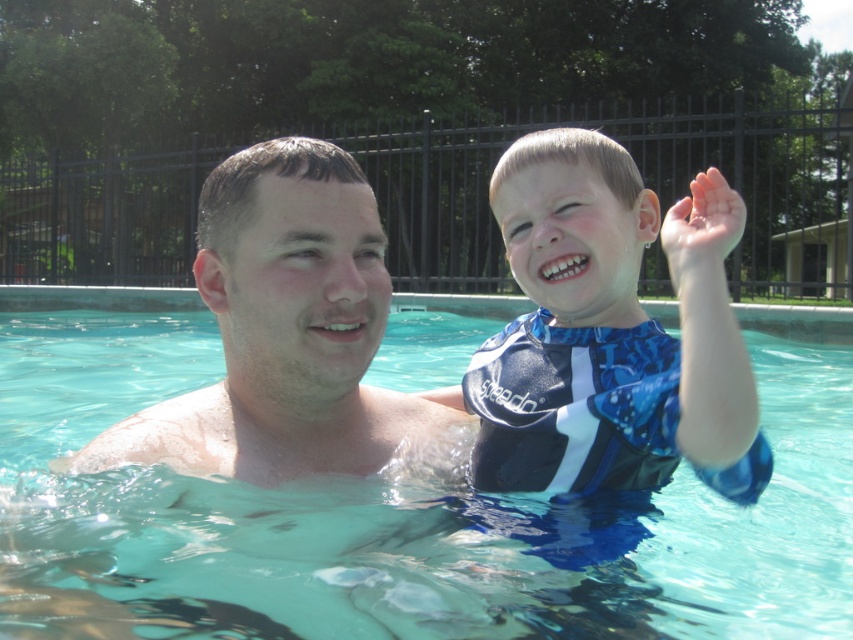
Question: Is clear blue water at upper center thinner than blue/white textured life vest at center?

Choices:
 (A) yes
 (B) no

Answer: (B)

Question: Which point is farther from the camera taking this photo?

Choices:
 (A) (161, 452)
 (B) (679, 266)

Answer: (A)

Question: Which of the following is the closest to the observer?

Choices:
 (A) (364, 188)
 (B) (689, 225)

Answer: (B)

Question: Is clear blue water at upper center to the left of blue/white textured life vest at center from the viewer's perspective?

Choices:
 (A) yes
 (B) no

Answer: (A)

Question: Which object appears closest to the camera in this image?

Choices:
 (A) transparent plastic hand at upper right
 (B) blue/white textured life vest at center
 (C) smooth skin man at center
 (D) clear blue water at upper center

Answer: (B)

Question: Is blue/white textured life vest at center positioned before transparent plastic hand at upper right?

Choices:
 (A) no
 (B) yes

Answer: (B)